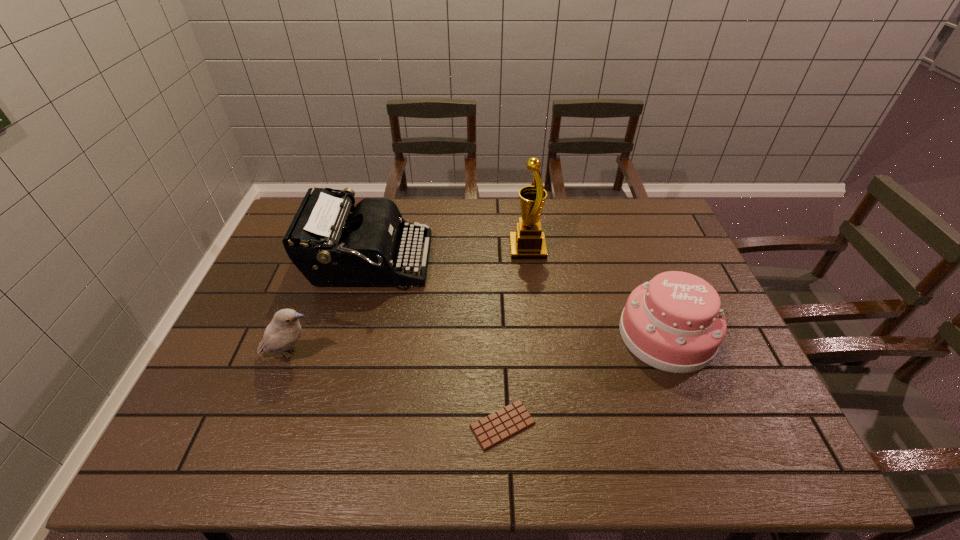
In order to click on blank region between the bird and the shortest object in this screenshot , I will do `click(396, 390)`.

What are the coordinates of `free spot between the bird and the birthday cake` in the screenshot? It's located at coord(478,345).

This screenshot has height=540, width=960. I want to click on vacant area that lies between the rightmost object and the award, so click(597, 292).

Find the location of a particular element. vacant space that's between the birthday cake and the tallest object is located at coordinates (597, 292).

Select which object is the third closest to the bird. Please provide its 2D coordinates. Your answer should be formatted as a tuple, i.e. [(x, y)], where the tuple contains the x and y coordinates of a point satisfying the conditions above.

[(528, 242)]

Identify which object is the fourth closest to the typewriter. Please provide its 2D coordinates. Your answer should be formatted as a tuple, i.e. [(x, y)], where the tuple contains the x and y coordinates of a point satisfying the conditions above.

[(674, 323)]

At what (x,y) coordinates should I click in order to perform the action: click on free spot that satisfies the following two spatial constraints: 1. on the typing side of the nearest object; 2. on the right side of the typewriter. Please return your answer as a coordinate pair (x, y). This screenshot has height=540, width=960. Looking at the image, I should click on (325, 425).

Identify the location of vacant area in the image that satisfies the following two spatial constraints: 1. at the beak of the shortest object; 2. on the right side of the bird. (265, 425).

Locate an element on the screen. vacant space that satisfies the following two spatial constraints: 1. on the typing side of the typewriter; 2. on the right side of the rightmost object is located at coordinates (349, 335).

Identify the location of free point that satisfies the following two spatial constraints: 1. on the front side of the rightmost object; 2. at the beak of the bird. (674, 356).